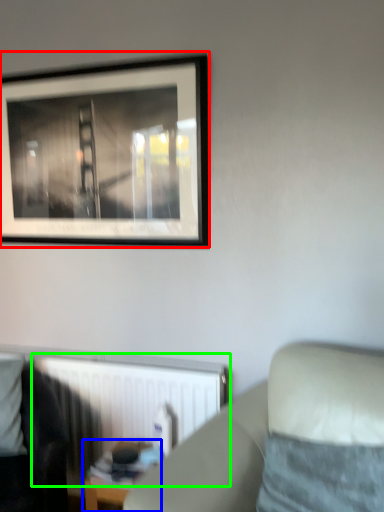
Question: Based on their relative distances, which object is nearer to picture frame (highlighted by a red box)? Choose from table (highlighted by a blue box) and radiator (highlighted by a green box).

Choices:
 (A) table
 (B) radiator

Answer: (B)